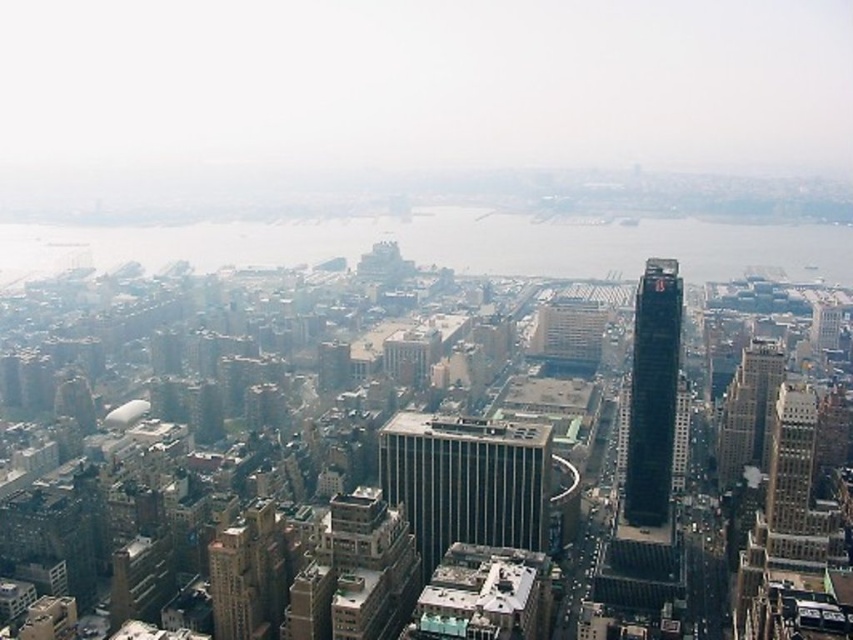
Who is taller, dark gray glass skyscraper at center-right or dark gray glass skyscraper at right?

Standing taller between the two is dark gray glass skyscraper at right.

Between dark gray glass skyscraper at center-right and dark gray glass skyscraper at right, which one appears on the left side from the viewer's perspective?

Positioned to the left is dark gray glass skyscraper at center-right.

Which is behind, point (718, 454) or point (807, 513)?

Positioned behind is point (807, 513).

Find the location of a particular element. dark gray glass skyscraper at center-right is located at coordinates (747, 412).

Is gray concrete building at center taller than black glass skyscraper at center-right?

No.

Which is behind, point (486, 449) or point (643, 333)?

The point (643, 333) is behind.

From the picture: Who is more forward, (439, 417) or (665, 442)?

Positioned in front is point (439, 417).

Image resolution: width=853 pixels, height=640 pixels. What are the coordinates of `gray concrete building at center` in the screenshot? It's located at (466, 481).

Locate an element on the screen. The width and height of the screenshot is (853, 640). black glass skyscraper at center-right is located at coordinates (653, 394).

The image size is (853, 640). What do you see at coordinates (653, 394) in the screenshot? I see `black glass skyscraper at center-right` at bounding box center [653, 394].

Where is `black glass skyscraper at center-right`? This screenshot has height=640, width=853. black glass skyscraper at center-right is located at coordinates (653, 394).